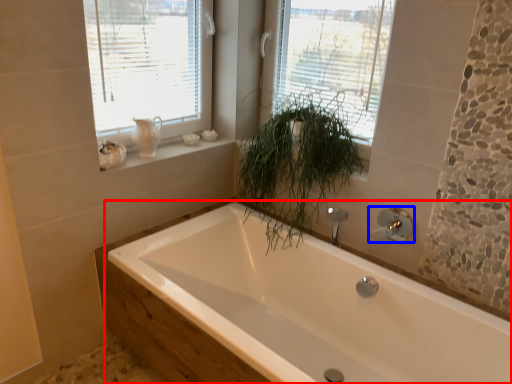
Question: Among these objects, which one is nearest to the camera, bathtub (highlighted by a red box) or tap (highlighted by a blue box)?

Choices:
 (A) bathtub
 (B) tap

Answer: (A)